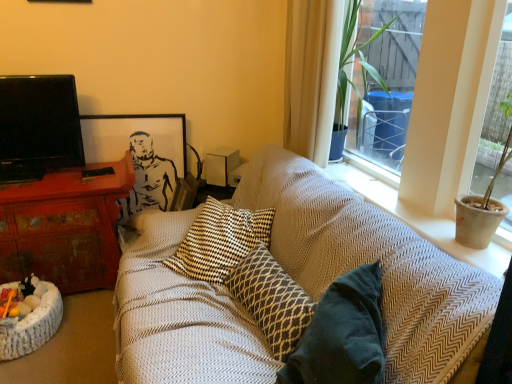
Question: Does black glossy tv at left have a greater height compared to distressed wood desk at left?

Choices:
 (A) no
 (B) yes

Answer: (A)

Question: Does black glossy tv at left appear on the right side of distressed wood desk at left?

Choices:
 (A) no
 (B) yes

Answer: (A)

Question: Are black glossy tv at left and distressed wood desk at left beside each other?

Choices:
 (A) no
 (B) yes

Answer: (A)

Question: Is there a large distance between black glossy tv at left and distressed wood desk at left?

Choices:
 (A) no
 (B) yes

Answer: (A)

Question: From a real-world perspective, does black glossy tv at left stand above distressed wood desk at left?

Choices:
 (A) no
 (B) yes

Answer: (B)

Question: Does point (207, 165) appear closer or farther from the camera than point (473, 23)?

Choices:
 (A) closer
 (B) farther

Answer: (B)

Question: Considering the positions of white matte speaker at upper center and textured beige cushion at upper right in the image, is white matte speaker at upper center bigger or smaller than textured beige cushion at upper right?

Choices:
 (A) small
 (B) big

Answer: (A)

Question: Is white matte speaker at upper center spatially inside textured beige cushion at upper right, or outside of it?

Choices:
 (A) outside
 (B) inside

Answer: (A)

Question: Is white matte speaker at upper center taller or shorter than textured beige cushion at upper right?

Choices:
 (A) tall
 (B) short

Answer: (B)

Question: Does point (28, 112) appear closer or farther from the camera than point (227, 165)?

Choices:
 (A) closer
 (B) farther

Answer: (A)

Question: Is black glossy tv at left inside or outside of white matte speaker at upper center?

Choices:
 (A) outside
 (B) inside

Answer: (A)

Question: Based on their positions, is black glossy tv at left located to the left or right of white matte speaker at upper center?

Choices:
 (A) left
 (B) right

Answer: (A)

Question: Considering the positions of black glossy tv at left and white matte speaker at upper center in the image, is black glossy tv at left wider or thinner than white matte speaker at upper center?

Choices:
 (A) wide
 (B) thin

Answer: (B)

Question: Considering their positions, is white sheer curtain at upper right located in front of or behind woven fabric cat bed at lower left?

Choices:
 (A) behind
 (B) front

Answer: (B)

Question: Does point (309, 9) appear closer or farther from the camera than point (9, 327)?

Choices:
 (A) farther
 (B) closer

Answer: (A)